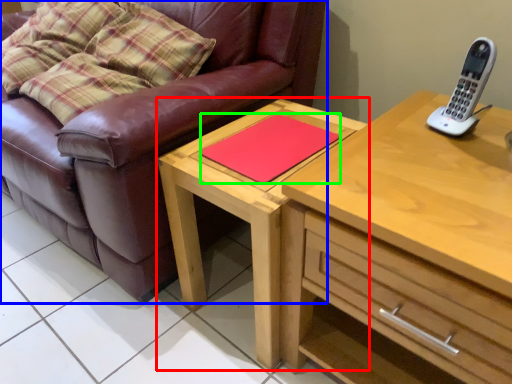
Question: Based on their relative distances, which object is farther from table (highlighted by a red box)? Choose from studio couch (highlighted by a blue box) and pad (highlighted by a green box).

Choices:
 (A) studio couch
 (B) pad

Answer: (A)